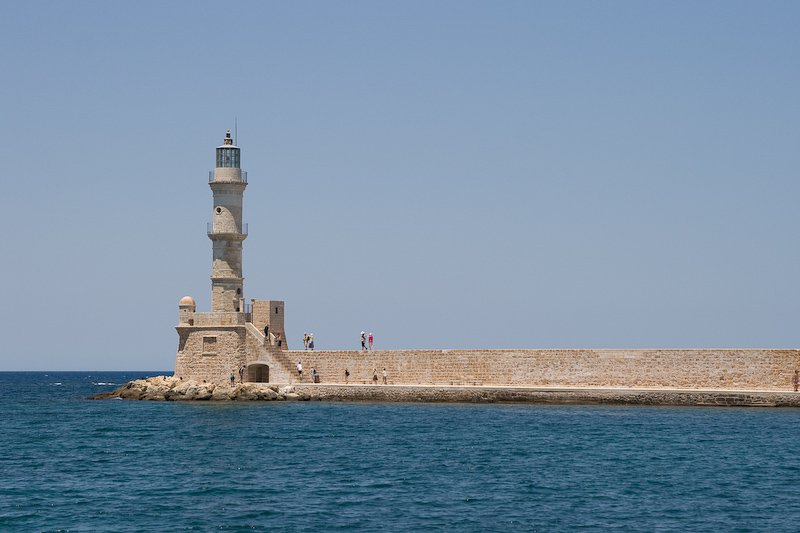
Identify the location of stair. This screenshot has width=800, height=533. (266, 344).